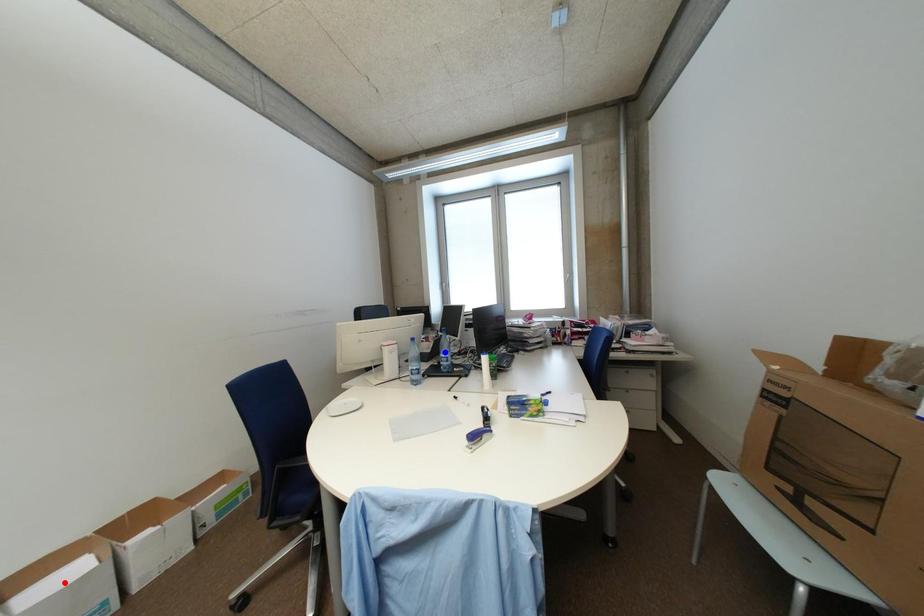
Question: Two points are marked on the image. Which point is closer to the camera?

Choices:
 (A) Blue point is closer.
 (B) Red point is closer.

Answer: (B)